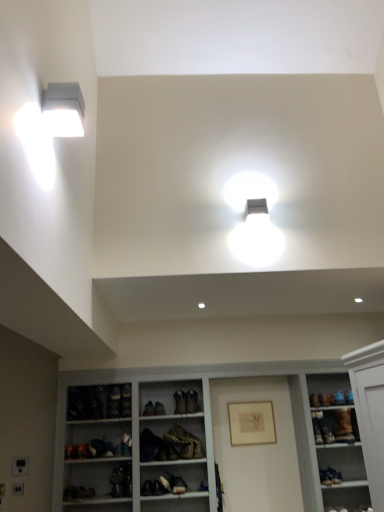
Question: Which direction should I rotate to look at matte black shoe at center, the 1th shoe from the left?

Choices:
 (A) left
 (B) right

Answer: (A)

Question: From the image's perspective, is white matte exhaust hood at upper left over matte brown picture frame at center?

Choices:
 (A) no
 (B) yes

Answer: (B)

Question: Does white matte exhaust hood at upper left have a greater height compared to matte brown picture frame at center?

Choices:
 (A) no
 (B) yes

Answer: (A)

Question: Does white matte exhaust hood at upper left have a lesser height compared to matte brown picture frame at center?

Choices:
 (A) no
 (B) yes

Answer: (B)

Question: Does white matte exhaust hood at upper left appear on the left side of matte brown picture frame at center?

Choices:
 (A) yes
 (B) no

Answer: (A)

Question: Does white matte exhaust hood at upper left lie in front of matte brown picture frame at center?

Choices:
 (A) no
 (B) yes

Answer: (B)

Question: Considering the relative sizes of white matte exhaust hood at upper left and matte brown picture frame at center in the image provided, is white matte exhaust hood at upper left smaller than matte brown picture frame at center?

Choices:
 (A) no
 (B) yes

Answer: (A)

Question: From a real-world perspective, does white wood shelves at center sit lower than matte black shoe at center, positioned as the second shoe in right-to-left order?

Choices:
 (A) no
 (B) yes

Answer: (B)

Question: Is white wood shelves at center shorter than matte black shoe at center, positioned as the second shoe in right-to-left order?

Choices:
 (A) yes
 (B) no

Answer: (B)

Question: Is white wood shelves at center facing away from matte black shoe at center, which appears as the 2th shoe when viewed from the left?

Choices:
 (A) yes
 (B) no

Answer: (A)

Question: Does white wood shelves at center have a lesser width compared to matte black shoe at center, which appears as the 2th shoe when viewed from the left?

Choices:
 (A) no
 (B) yes

Answer: (A)

Question: Is white wood shelves at center completely or partially outside of matte black shoe at center, positioned as the second shoe in right-to-left order?

Choices:
 (A) yes
 (B) no

Answer: (A)

Question: Can you confirm if white wood shelves at center is positioned to the left of matte black shoe at center, which appears as the 2th shoe when viewed from the left?

Choices:
 (A) yes
 (B) no

Answer: (B)

Question: Is white wood shelves at center to the right of brown suede shoe at lower right, the third shoe viewed from the left, from the viewer's perspective?

Choices:
 (A) yes
 (B) no

Answer: (B)